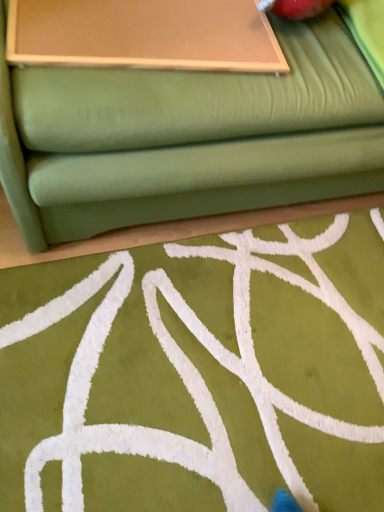
You are a GUI agent. You are given a task and a screenshot of the screen. Output one action in this format:
    pyautogui.click(x=<x>, y=<y>)
    Task: Click on the free space above matte brown board at upper center (from a real-world perspective)
    
    Given the screenshot: What is the action you would take?
    pyautogui.click(x=120, y=18)